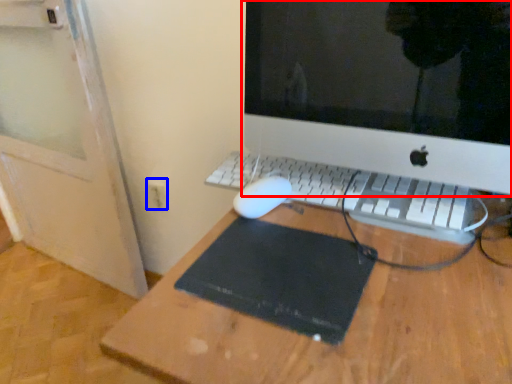
Question: Which of the following is the farthest to the observer, computer monitor (highlighted by a red box) or electric outlet (highlighted by a blue box)?

Choices:
 (A) computer monitor
 (B) electric outlet

Answer: (B)